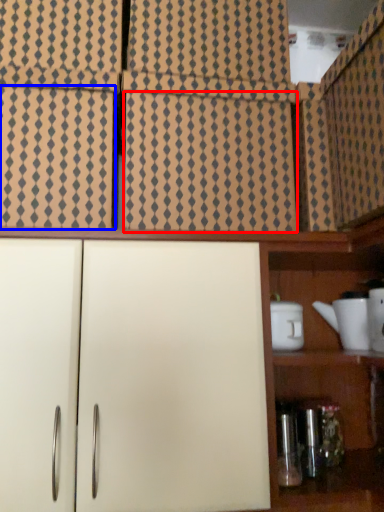
Question: Which object is further to the camera taking this photo, tile (highlighted by a red box) or cabinetry (highlighted by a blue box)?

Choices:
 (A) tile
 (B) cabinetry

Answer: (A)